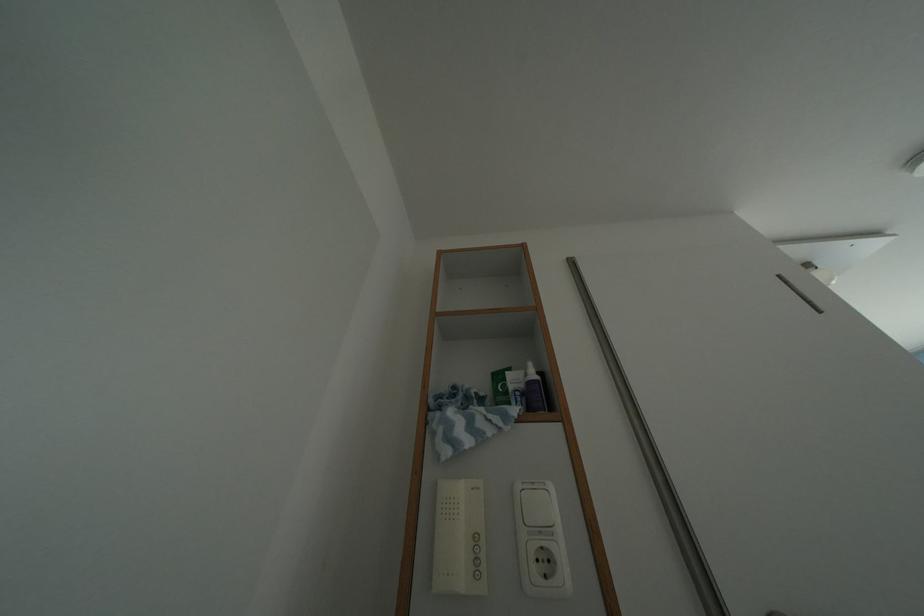
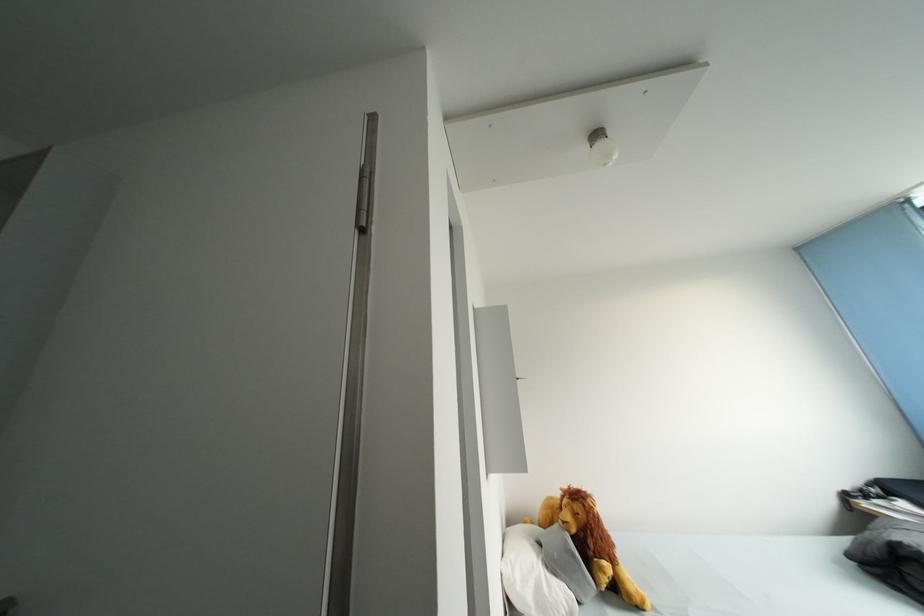
Question: Which direction would the cameraman need to move to produce the second image? Reply with the corresponding letter.

Choices:
 (A) Left
 (B) Right
 (C) Forward
 (D) Backward

Answer: (B)